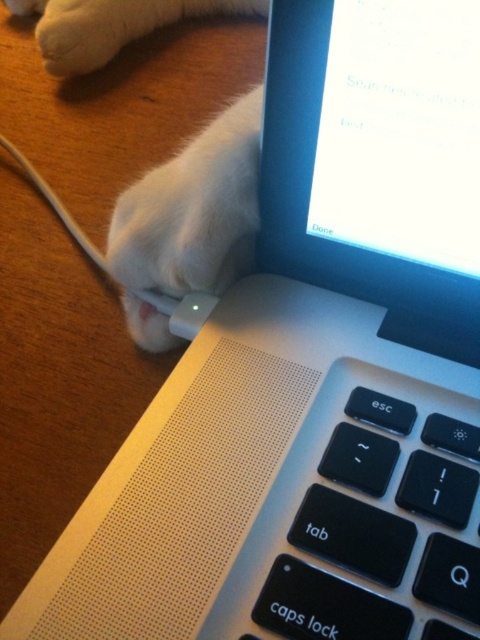
Question: Does matte black screen at upper right have a greater width compared to black matte keyboard at center?

Choices:
 (A) yes
 (B) no

Answer: (B)

Question: Which point appears closest to the camera in this image?

Choices:
 (A) (363, 122)
 (B) (429, 602)

Answer: (B)

Question: Can you confirm if matte black screen at upper right is positioned to the right of black matte keyboard at center?

Choices:
 (A) no
 (B) yes

Answer: (A)

Question: Does matte black screen at upper right have a smaller size compared to black matte keyboard at center?

Choices:
 (A) yes
 (B) no

Answer: (B)

Question: Which object appears closest to the camera in this image?

Choices:
 (A) matte black screen at upper right
 (B) black matte keyboard at center

Answer: (B)